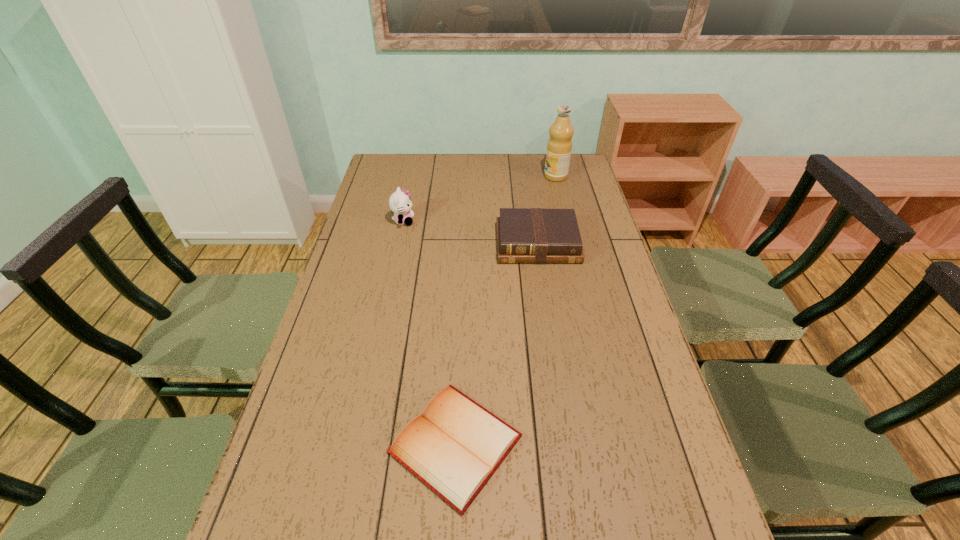
The width and height of the screenshot is (960, 540). Find the location of `free space between the leftmost object and the taller Bible`. free space between the leftmost object and the taller Bible is located at coordinates (470, 232).

This screenshot has height=540, width=960. Identify the location of object that stands as the second closest to the olive oil. (400, 203).

Locate an element on the screen. The image size is (960, 540). object that ranks as the second closest to the leftmost object is located at coordinates (559, 146).

At what (x,y) coordinates should I click in order to perform the action: click on blank area in the image that satisfies the following two spatial constraints: 1. on the front-facing side of the leftmost object; 2. on the right side of the nearest object. Please return your answer as a coordinate pair (x, y). Looking at the image, I should click on (355, 444).

At what (x,y) coordinates should I click in order to perform the action: click on free location that satisfies the following two spatial constraints: 1. on the label of the olive oil; 2. on the spine side of the taller Bible. Please return your answer as a coordinate pair (x, y). This screenshot has height=540, width=960. Looking at the image, I should click on tap(572, 244).

This screenshot has width=960, height=540. I want to click on vacant area in the image that satisfies the following two spatial constraints: 1. on the front-facing side of the shorter Bible; 2. on the left side of the third shortest object, so click(355, 444).

At what (x,y) coordinates should I click in order to perform the action: click on free point that satisfies the following two spatial constraints: 1. on the front-facing side of the third shortest object; 2. on the right side of the shortest object. Please return your answer as a coordinate pair (x, y). This screenshot has width=960, height=540. Looking at the image, I should click on (355, 444).

You are a GUI agent. You are given a task and a screenshot of the screen. Output one action in this format:
    pyautogui.click(x=<x>, y=<y>)
    Task: Click on the vacant point that satisfies the following two spatial constraints: 1. on the label of the farthest object; 2. on the front side of the nearer Bible
    This screenshot has height=540, width=960.
    Given the screenshot: What is the action you would take?
    pyautogui.click(x=620, y=444)

Image resolution: width=960 pixels, height=540 pixels. In order to click on free space in the image that satisfies the following two spatial constraints: 1. on the front-facing side of the kitten; 2. on the right side of the shorter Bible in this screenshot , I will do `click(355, 444)`.